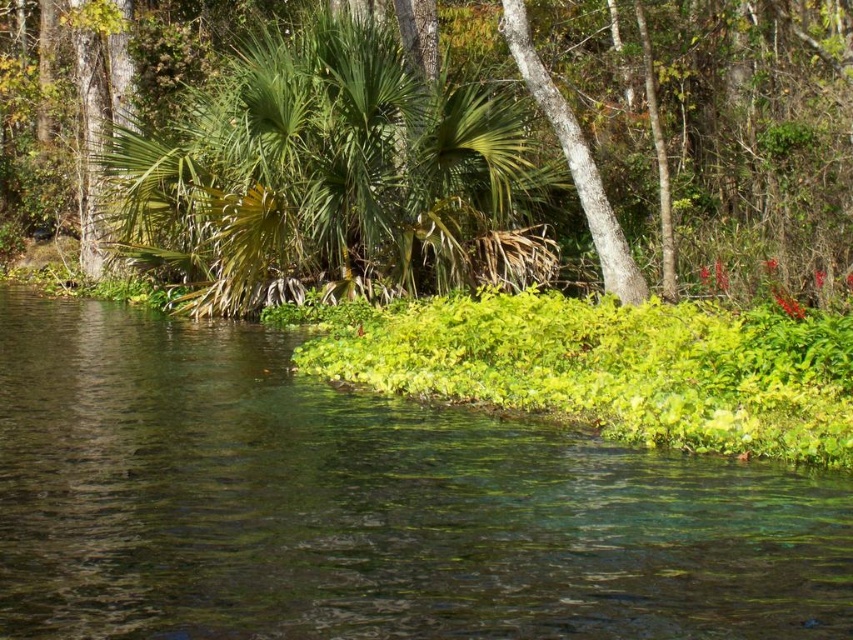
You are standing at a point in the scene and want to walk towards the point labeled as point (178,611). There is another point labeled point (741,81) behind you. Which direction should you move to reach the first point without passing through the second?

Since point (178,611) is in front of point (741,81), you should move forward in the direction towards point (178,611) to reach it without passing through the other point.